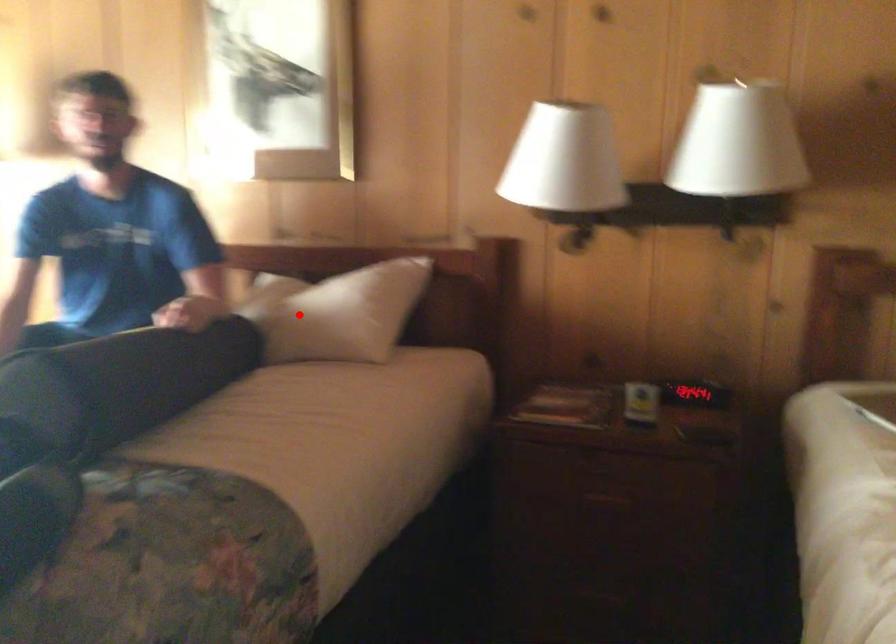
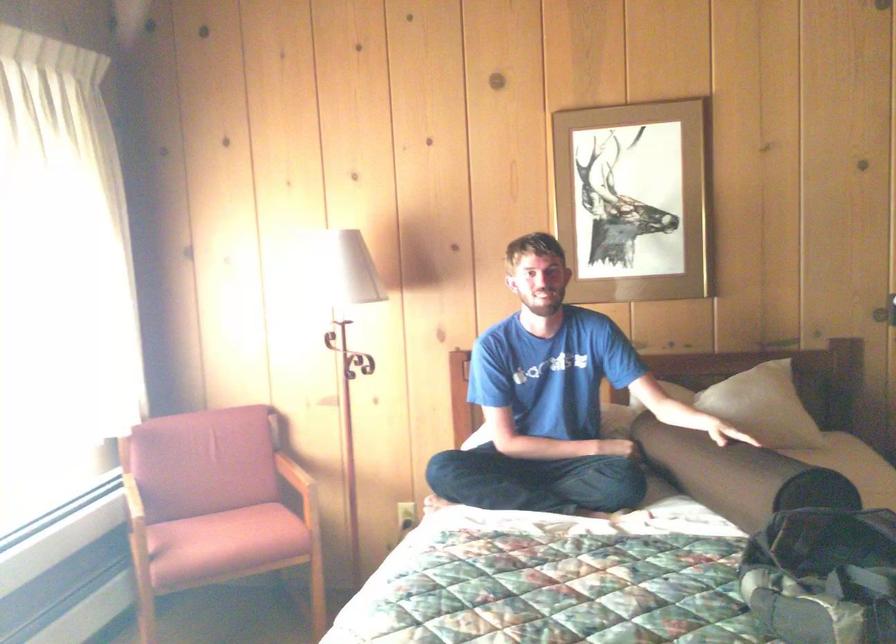
Question: I am providing you with two images of the same scene from different viewpoints. A red point is marked on the first image. Is the red point's position out of view in image 2?

Choices:
 (A) Yes
 (B) No

Answer: (B)